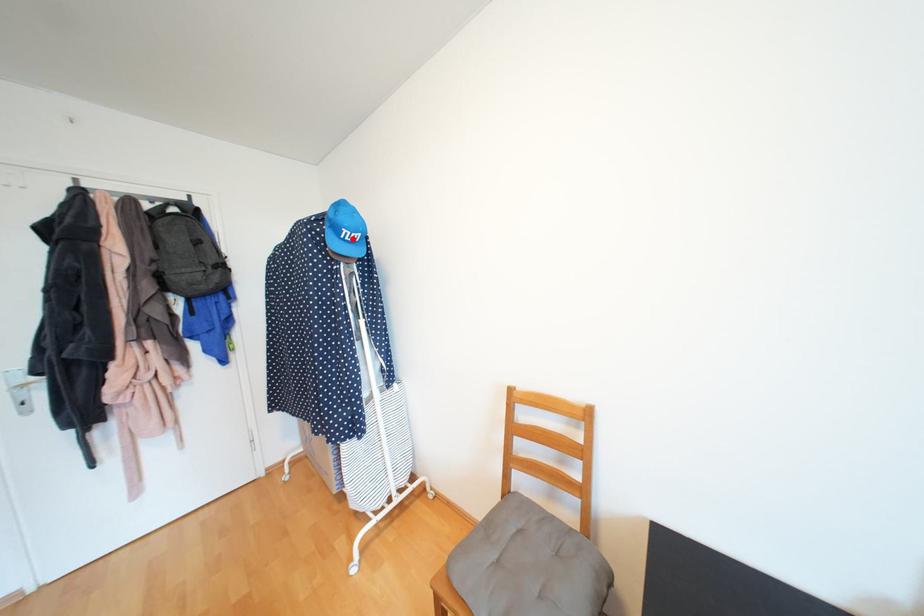
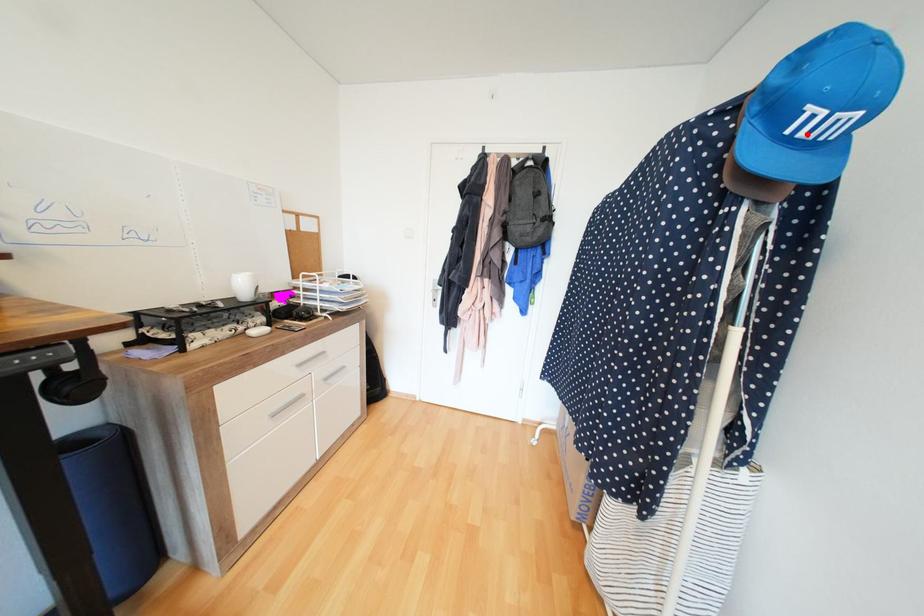
I am providing you with two images of the same scene from different viewpoints. A red point is marked on the first image and another point is marked on the second image. Is the red point in image1 aligned with the point shown in image2?

Yes